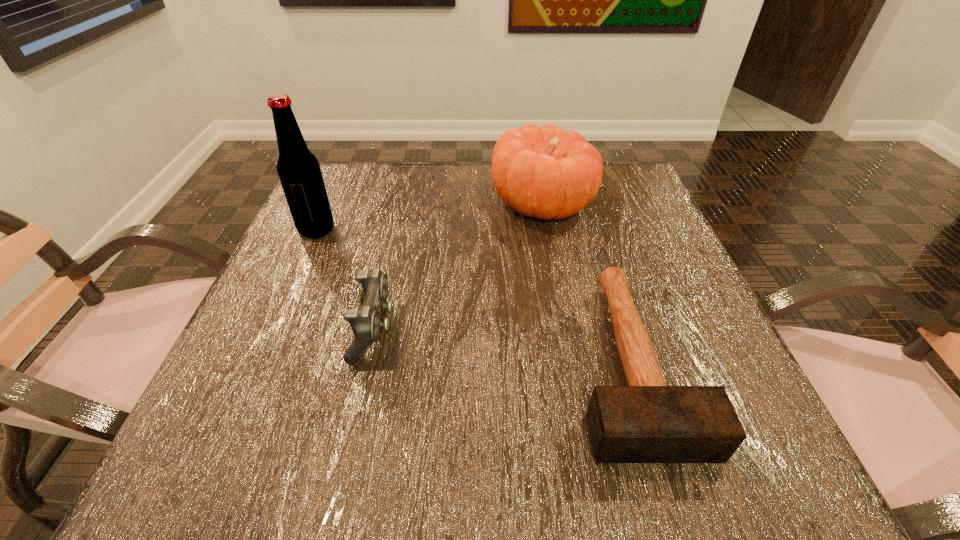
The height and width of the screenshot is (540, 960). Identify the location of vacant position at the far left corner of the desktop. (365, 214).

This screenshot has width=960, height=540. In order to click on free region at the far right corner in this screenshot , I will do `click(630, 163)`.

You are a GUI agent. You are given a task and a screenshot of the screen. Output one action in this format:
    pyautogui.click(x=<x>, y=<y>)
    Task: Click on the free point between the shortest object and the third tallest object
    The width and height of the screenshot is (960, 540).
    Given the screenshot: What is the action you would take?
    pyautogui.click(x=502, y=345)

You are a GUI agent. You are given a task and a screenshot of the screen. Output one action in this format:
    pyautogui.click(x=<x>, y=<y>)
    Task: Click on the vacant area that lies between the pumpkin and the shortest object
    
    Given the screenshot: What is the action you would take?
    pyautogui.click(x=586, y=282)

Image resolution: width=960 pixels, height=540 pixels. Find the location of `blank region between the third tallest object and the mallet`. blank region between the third tallest object and the mallet is located at coordinates (502, 345).

You are a GUI agent. You are given a task and a screenshot of the screen. Output one action in this format:
    pyautogui.click(x=<x>, y=<y>)
    Task: Click on the free area in between the third shortest object and the leftmost object
    
    Given the screenshot: What is the action you would take?
    coord(430,217)

The height and width of the screenshot is (540, 960). Identify the location of vacant space that is in between the tallest object and the shortest object. (473, 295).

The width and height of the screenshot is (960, 540). Find the location of `free spot between the shortest object and the pumpkin`. free spot between the shortest object and the pumpkin is located at coordinates (586, 282).

I want to click on vacant space that's between the control and the beer bottle, so click(346, 280).

What are the coordinates of `free spot between the third tallest object and the second tallest object` in the screenshot? It's located at (458, 267).